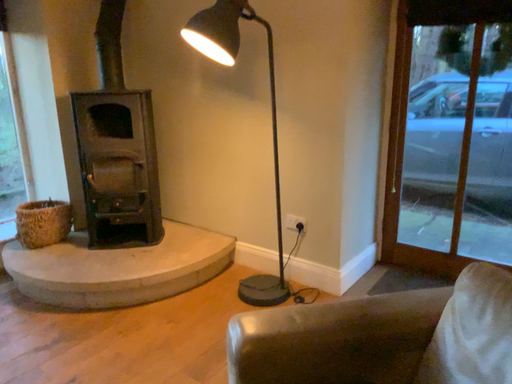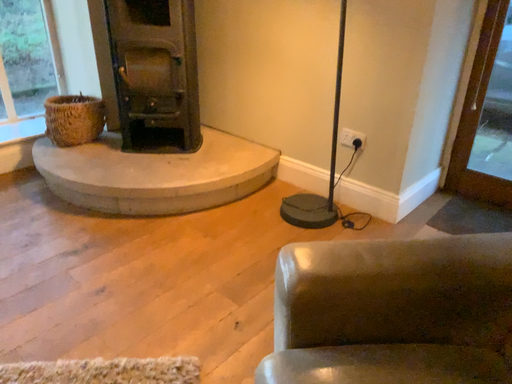
Question: Which way did the camera rotate in the video?

Choices:
 (A) rotated downward
 (B) rotated upward

Answer: (A)